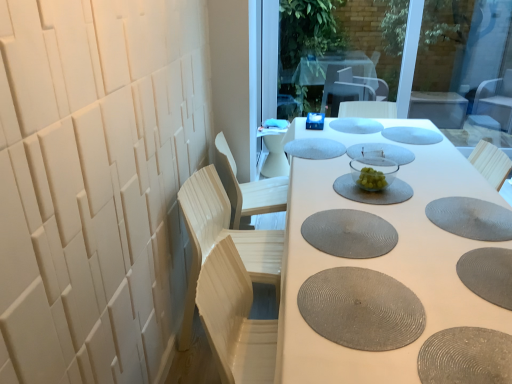
Identify the location of vacant area that lies between gray textured placemat at lower right, placed as the third manhole cover when sorted from front to back, and clear glass bowl at center, which is the fourth manhole cover in back-to-front order. (434, 201).